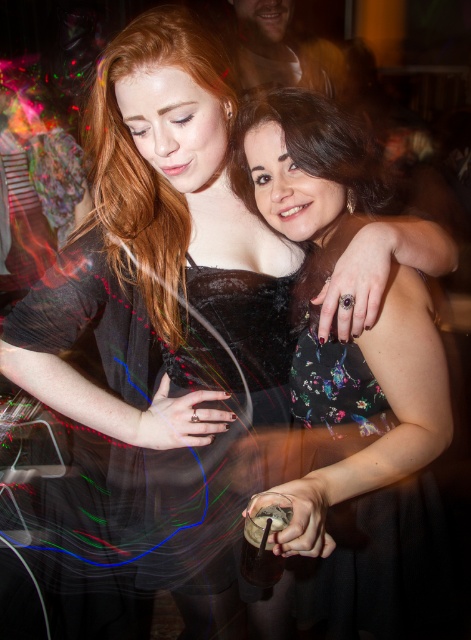
Question: Observing the image, what is the correct spatial positioning of black floral dress at center in reference to black sheer dress at center?

Choices:
 (A) right
 (B) left

Answer: (A)

Question: Does black floral dress at center have a larger size compared to black sheer dress at center?

Choices:
 (A) no
 (B) yes

Answer: (B)

Question: Which point is farther to the camera?

Choices:
 (A) (184, 321)
 (B) (358, 595)

Answer: (B)

Question: Which point is closer to the camera?

Choices:
 (A) (275, 344)
 (B) (387, 394)

Answer: (B)

Question: Which point is closer to the camera?

Choices:
 (A) black floral dress at center
 (B) black sheer dress at center

Answer: (A)

Question: Does black floral dress at center have a larger size compared to black sheer dress at center?

Choices:
 (A) yes
 (B) no

Answer: (A)